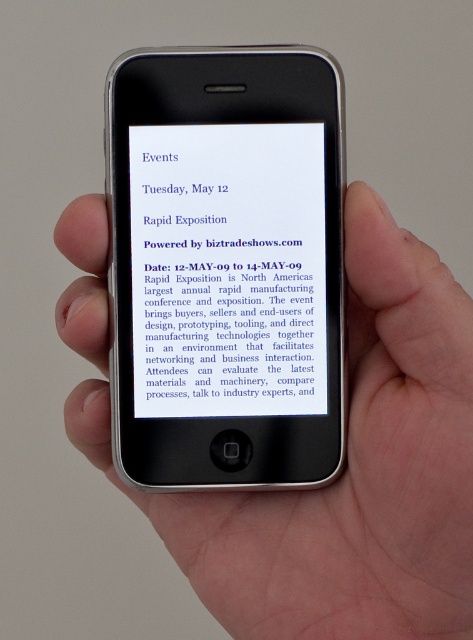
Question: Does black matte phone at center have a greater width compared to blue paper at center?

Choices:
 (A) no
 (B) yes

Answer: (B)

Question: Considering the real-world distances, which object is farthest from the black plastic phone at center?

Choices:
 (A) black matte phone at center
 (B) blue paper at center

Answer: (A)

Question: Does black matte phone at center have a lesser width compared to blue paper at center?

Choices:
 (A) no
 (B) yes

Answer: (A)

Question: Does black plastic phone at center have a larger size compared to blue paper at center?

Choices:
 (A) no
 (B) yes

Answer: (B)

Question: Estimate the real-world distances between objects in this image. Which object is farther from the black matte phone at center?

Choices:
 (A) blue paper at center
 (B) black plastic phone at center

Answer: (A)

Question: Which point is farther from the camera taking this photo?

Choices:
 (A) (184, 413)
 (B) (400, 573)

Answer: (A)